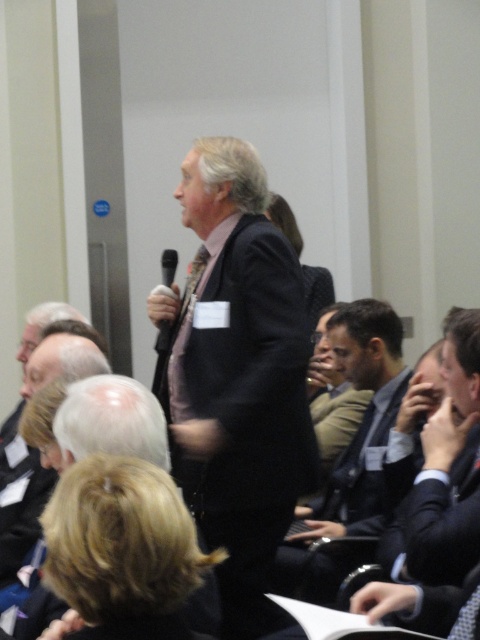
You are organizing a professional event and need to locate the attendee wearing a dark brown suit at center for a special award. According to the image, where exactly is this person positioned?

The dark brown suit at center is located at point (354, 435).

What are the coordinates of the dark suit at center?

The dark suit at center is located at coordinates point (237, 376).